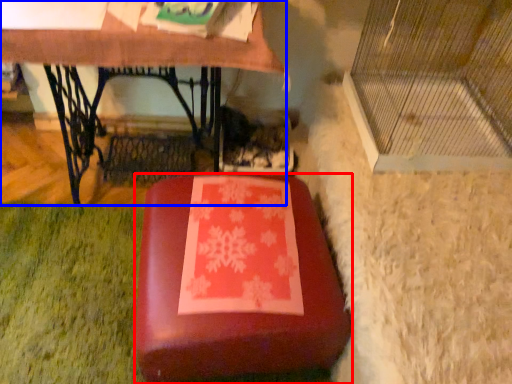
Question: Which object appears closest to the camera in this image, furniture (highlighted by a red box) or table (highlighted by a blue box)?

Choices:
 (A) furniture
 (B) table

Answer: (A)